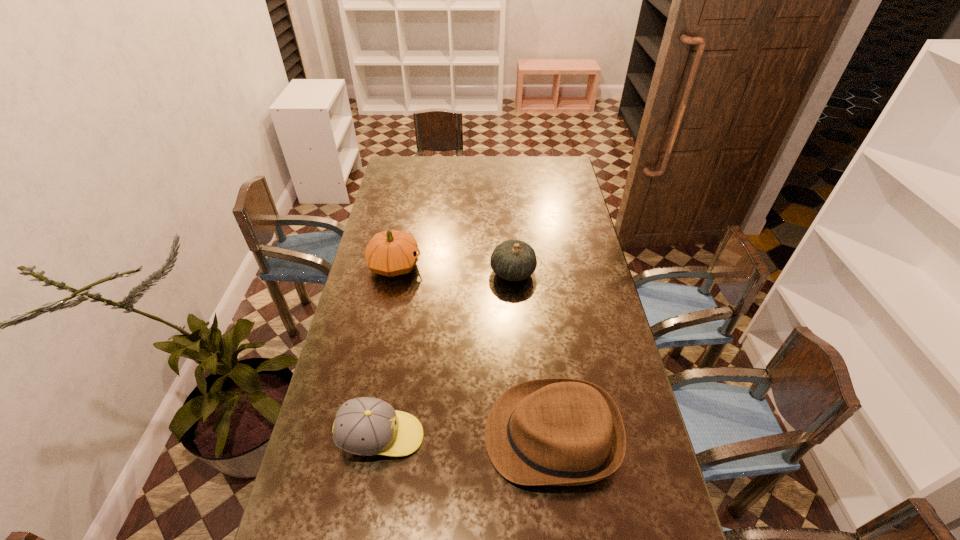
Where is `the taller gourd`? the taller gourd is located at coordinates (390, 253).

Find the location of a particular element. The width and height of the screenshot is (960, 540). the tallest object is located at coordinates (390, 253).

The width and height of the screenshot is (960, 540). I want to click on the shorter gourd, so click(513, 260).

Find the location of `baseball cap`. baseball cap is located at coordinates (365, 426).

The height and width of the screenshot is (540, 960). Identify the location of fedora. (556, 431).

Locate an element on the screen. free region located 0.240m on the side of the taller gourd with the carved face is located at coordinates (484, 266).

The width and height of the screenshot is (960, 540). Identify the location of free space located 0.380m on the front of the right gourd. (520, 375).

At what (x,y) coordinates should I click in order to perform the action: click on free space located 0.320m on the front-facing side of the baseball cap. Please return your answer as a coordinate pair (x, y). Image resolution: width=960 pixels, height=540 pixels. Looking at the image, I should click on (539, 437).

At what (x,y) coordinates should I click in order to perform the action: click on vacant space positioned 0.380m on the front-facing side of the fedora. Please return your answer as a coordinate pair (x, y). Looking at the image, I should click on (348, 436).

What are the coordinates of `free space located on the front-facing side of the fedora` in the screenshot? It's located at (398, 436).